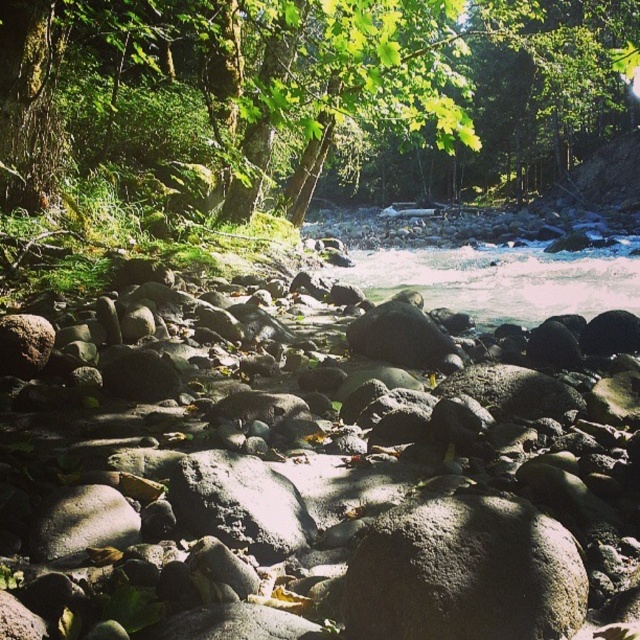
Is gray smooth rocks at center bigger than green mossy tree at upper center?

Actually, gray smooth rocks at center might be smaller than green mossy tree at upper center.

Is gray smooth rocks at center below green mossy tree at upper center?

Yes, gray smooth rocks at center is below green mossy tree at upper center.

Between point (112, 593) and point (74, 76), which one is positioned behind?

Point (74, 76)

Find the location of a particular element. The height and width of the screenshot is (640, 640). gray smooth rocks at center is located at coordinates (321, 486).